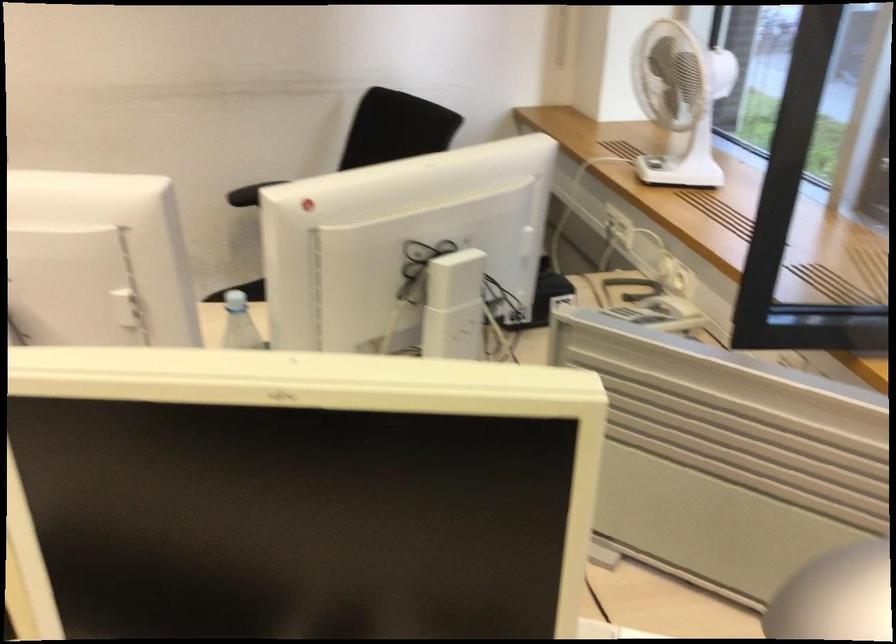
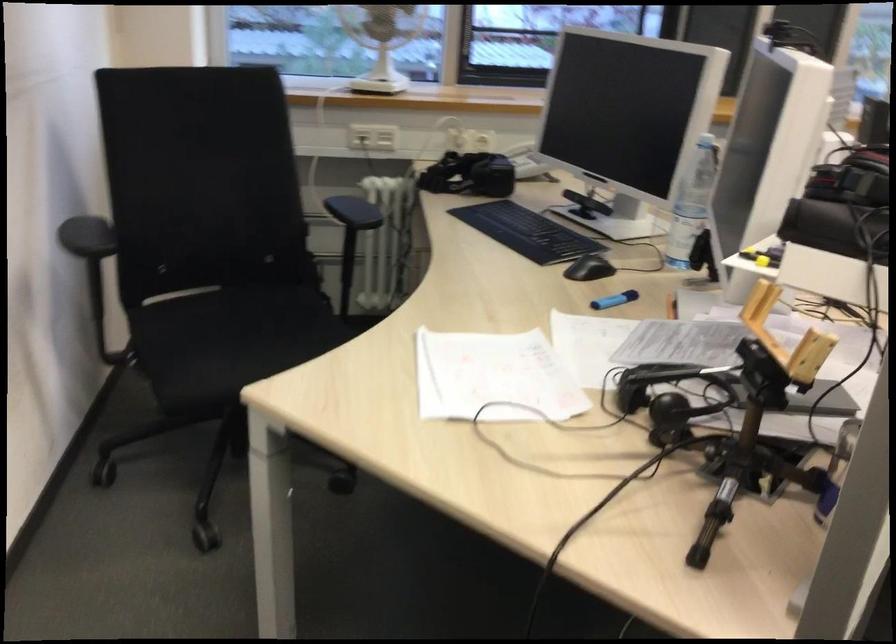
Where in the second image is the point corresponding to point 617,218 from the first image?

(358, 138)